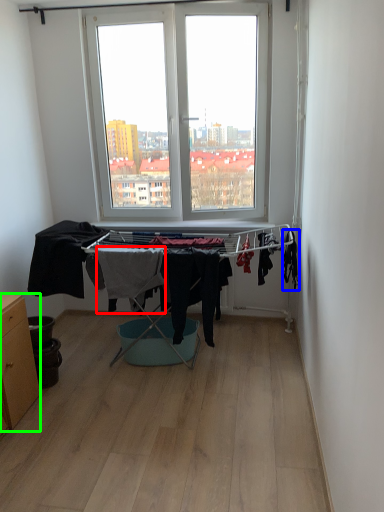
Question: Which object is positioned closest to clothing (highlighted by a red box)? Select from clothing (highlighted by a blue box) and table (highlighted by a green box).

Choices:
 (A) clothing
 (B) table

Answer: (B)